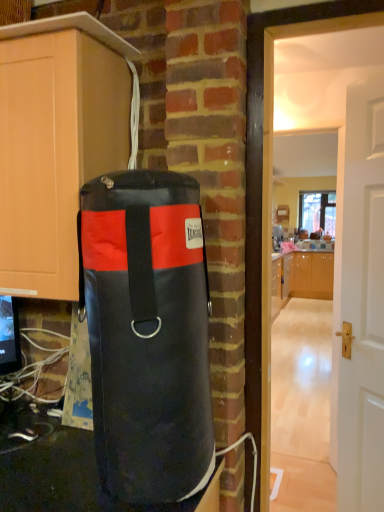
What is the approximate height of glossy wood cabinets at center, the first cabinetry in the right-to-left sequence?

glossy wood cabinets at center, the first cabinetry in the right-to-left sequence, is 39.17 inches tall.

This screenshot has height=512, width=384. What do you see at coordinates (147, 334) in the screenshot?
I see `black leather punching bag at left` at bounding box center [147, 334].

Locate an element on the screen. The height and width of the screenshot is (512, 384). white glossy door at center right is located at coordinates (362, 300).

From the picture: From a real-world perspective, is glossy wood cabinets at center, the first cabinetry in the right-to-left sequence, positioned above or below black leather punching bag at left?

glossy wood cabinets at center, the first cabinetry in the right-to-left sequence, is situated lower than black leather punching bag at left in the real world.

Does glossy wood cabinets at center, the first cabinetry in the right-to-left sequence, turn towards black leather punching bag at left?

Yes, glossy wood cabinets at center, the first cabinetry in the right-to-left sequence, is oriented towards black leather punching bag at left.

From the picture: Who is shorter, glossy wood cabinets at center, the 1th cabinetry from the back, or black leather punching bag at left?

Standing shorter between the two is black leather punching bag at left.

From the image's perspective, between glossy wood cabinets at center, arranged as the 2th cabinetry when viewed from the front, and black leather punching bag at left, who is located below?

glossy wood cabinets at center, arranged as the 2th cabinetry when viewed from the front, from the image's perspective.

From a real-world perspective, which object stands above the other?

white glossy door at center right.

Is white glossy door at center right not inside glossy wood cabinets at center, the 1th cabinetry from the back?

Yes, white glossy door at center right is not within glossy wood cabinets at center, the 1th cabinetry from the back.

Find the location of `cabinetry directly beneath the white glossy door at center right (from a real-world perspective)`. cabinetry directly beneath the white glossy door at center right (from a real-world perspective) is located at coordinates (311, 274).

Does white glossy door at center right appear on the left side of glossy wood cabinets at center, placed as the second cabinetry when sorted from left to right?

Indeed, white glossy door at center right is positioned on the left side of glossy wood cabinets at center, placed as the second cabinetry when sorted from left to right.

Is matte wood cabinet at left, arranged as the second cabinetry when viewed from the right, facing towards glossy wood cabinets at center, placed as the second cabinetry when sorted from left to right?

No, matte wood cabinet at left, arranged as the second cabinetry when viewed from the right, does not turn towards glossy wood cabinets at center, placed as the second cabinetry when sorted from left to right.

Is matte wood cabinet at left, the 2th cabinetry when ordered from back to front, thinner than glossy wood cabinets at center, placed as the second cabinetry when sorted from left to right?

Yes.

Looking at this image, is matte wood cabinet at left, arranged as the second cabinetry when viewed from the right, located outside glossy wood cabinets at center, the first cabinetry in the right-to-left sequence?

That's correct, matte wood cabinet at left, arranged as the second cabinetry when viewed from the right, is outside of glossy wood cabinets at center, the first cabinetry in the right-to-left sequence.

Considering the points (73, 255) and (313, 273), which point is behind, point (73, 255) or point (313, 273)?

Positioned behind is point (313, 273).

Find the location of `door on the right of the matte wood cabinet at left, marked as the 1th cabinetry in a front-to-back arrangement`. door on the right of the matte wood cabinet at left, marked as the 1th cabinetry in a front-to-back arrangement is located at coordinates (362, 300).

Is matte wood cabinet at left, acting as the 1th cabinetry starting from the left, aimed at white glossy door at center right?

No, matte wood cabinet at left, acting as the 1th cabinetry starting from the left, is not turned towards white glossy door at center right.

From the image's perspective, is matte wood cabinet at left, acting as the 1th cabinetry starting from the left, on white glossy door at center right?

Yes, from the image's perspective, matte wood cabinet at left, acting as the 1th cabinetry starting from the left, is over white glossy door at center right.

From the image's perspective, is white glossy door at center right on top of black leather punching bag at left?

Actually, white glossy door at center right appears below black leather punching bag at left in the image.

Is white glossy door at center right next to black leather punching bag at left and touching it?

No, white glossy door at center right is not beside black leather punching bag at left.

Looking at their sizes, would you say white glossy door at center right is wider or thinner than black leather punching bag at left?

white glossy door at center right is thinner than black leather punching bag at left.

Is black leather punching bag at left inside white glossy door at center right?

Actually, black leather punching bag at left is outside white glossy door at center right.

Considering the relative positions of glossy wood cabinets at center, the first cabinetry in the right-to-left sequence, and white glossy door at center right in the image provided, is glossy wood cabinets at center, the first cabinetry in the right-to-left sequence, to the right of white glossy door at center right from the viewer's perspective?

Yes.

Which is farther, (307,256) or (364,356)?

The point (307,256) is farther.

From the image's perspective, does glossy wood cabinets at center, the first cabinetry in the right-to-left sequence, appear lower than white glossy door at center right?

Yes.

From the image's perspective, which one is positioned higher, black leather punching bag at left or white glossy door at center right?

From the image's view, black leather punching bag at left is above.

Can you confirm if black leather punching bag at left is wider than white glossy door at center right?

Yes.

Is black leather punching bag at left to the left or to the right of white glossy door at center right in the image?

From the image, it's evident that black leather punching bag at left is to the left of white glossy door at center right.

From a real-world perspective, relative to white glossy door at center right, is black leather punching bag at left vertically above or below?

From a real-world perspective, black leather punching bag at left is physically above white glossy door at center right.

This screenshot has height=512, width=384. I want to click on cabinetry beneath the black leather punching bag at left (from a real-world perspective), so click(311, 274).

The height and width of the screenshot is (512, 384). What are the coordinates of `cabinetry below the white glossy door at center right (from the image's perspective)` in the screenshot? It's located at (311, 274).

Considering their positions, is matte wood cabinet at left, acting as the 1th cabinetry starting from the left, positioned closer to black leather punching bag at left than glossy wood cabinets at center, placed as the second cabinetry when sorted from left to right?

matte wood cabinet at left, acting as the 1th cabinetry starting from the left, is closer to black leather punching bag at left.

Based on their spatial positions, is glossy wood cabinets at center, the 1th cabinetry from the back, or black leather punching bag at left further from white glossy door at center right?

glossy wood cabinets at center, the 1th cabinetry from the back, is positioned further to the anchor white glossy door at center right.

From the picture: From the image, which object appears to be nearer to matte wood cabinet at left, arranged as the second cabinetry when viewed from the right, glossy wood cabinets at center, the 1th cabinetry from the back, or black leather punching bag at left?

black leather punching bag at left lies closer to matte wood cabinet at left, arranged as the second cabinetry when viewed from the right, than the other object.

From the image, which object appears to be nearer to white glossy door at center right, glossy wood cabinets at center, placed as the second cabinetry when sorted from left to right, or matte wood cabinet at left, acting as the 1th cabinetry starting from the left?

The object closer to white glossy door at center right is matte wood cabinet at left, acting as the 1th cabinetry starting from the left.

Looking at the image, which one is located further to matte wood cabinet at left, acting as the 1th cabinetry starting from the left, black leather punching bag at left or white glossy door at center right?

white glossy door at center right is positioned further to the anchor matte wood cabinet at left, acting as the 1th cabinetry starting from the left.

Consider the image. Estimate the real-world distances between objects in this image. Which object is closer to glossy wood cabinets at center, arranged as the 2th cabinetry when viewed from the front, black leather punching bag at left or white glossy door at center right?

white glossy door at center right is closer to glossy wood cabinets at center, arranged as the 2th cabinetry when viewed from the front.

When comparing their distances from matte wood cabinet at left, acting as the 1th cabinetry starting from the left, does glossy wood cabinets at center, the 1th cabinetry from the back, or white glossy door at center right seem closer?

Among the two, white glossy door at center right is located nearer to matte wood cabinet at left, acting as the 1th cabinetry starting from the left.

Which object lies nearer to the anchor point matte wood cabinet at left, acting as the 1th cabinetry starting from the left, white glossy door at center right or glossy wood cabinets at center, placed as the second cabinetry when sorted from left to right?

white glossy door at center right.

At what (x,y) coordinates should I click in order to perform the action: click on punching bag between matte wood cabinet at left, marked as the 1th cabinetry in a front-to-back arrangement, and white glossy door at center right. Please return your answer as a coordinate pair (x, y). The height and width of the screenshot is (512, 384). Looking at the image, I should click on (147, 334).

I want to click on cabinetry between black leather punching bag at left and glossy wood cabinets at center, arranged as the 2th cabinetry when viewed from the front, from front to back, so click(56, 142).

I want to click on door positioned between black leather punching bag at left and glossy wood cabinets at center, arranged as the 2th cabinetry when viewed from the front, from near to far, so click(362, 300).

You are a GUI agent. You are given a task and a screenshot of the screen. Output one action in this format:
    pyautogui.click(x=<x>, y=<y>)
    Task: Click on the door between matte wood cabinet at left, acting as the 1th cabinetry starting from the left, and glossy wood cabinets at center, arranged as the 2th cabinetry when viewed from the front, from front to back
    The width and height of the screenshot is (384, 512).
    Given the screenshot: What is the action you would take?
    point(362,300)